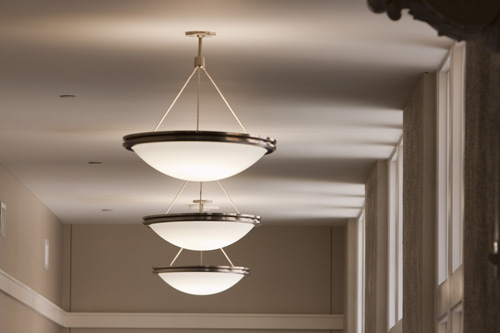
Image resolution: width=500 pixels, height=333 pixels. What are the coordinates of `decorative 3d walls in between windows` in the screenshot? It's located at (475, 150), (411, 203), (374, 210).